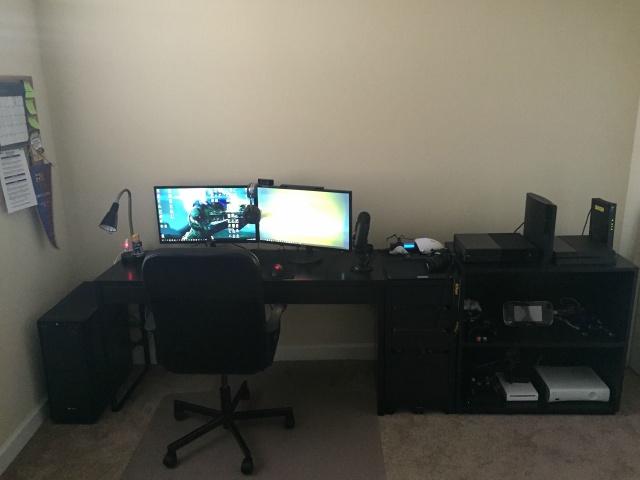
The image size is (640, 480). I want to click on calendar, so click(16, 120).